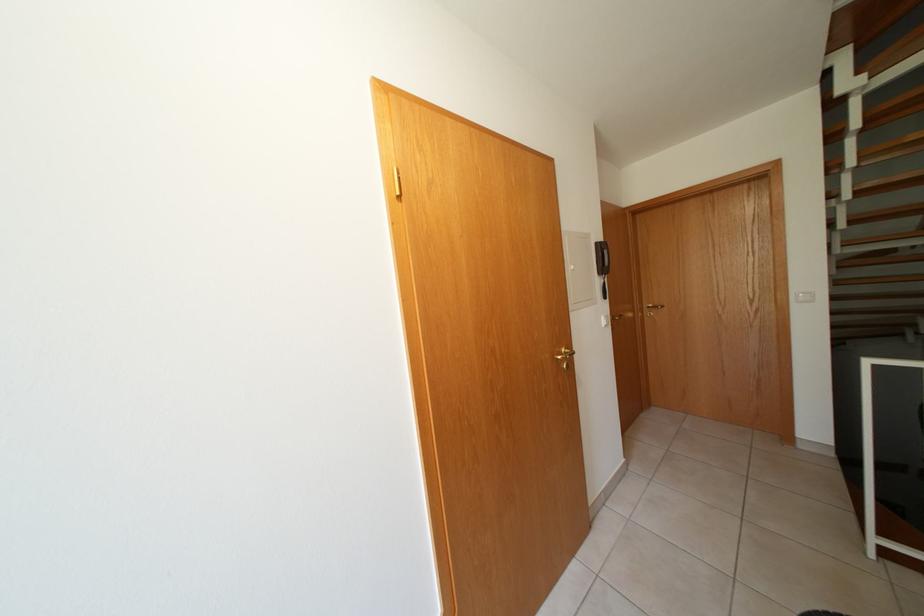
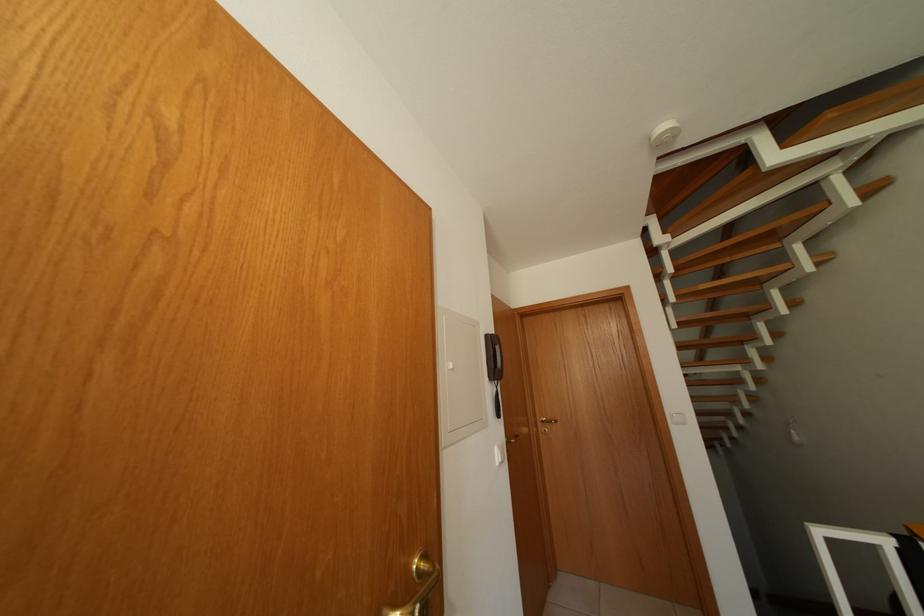
Where in the second image is the point corresponding to (578,273) from the first image?

(455, 371)